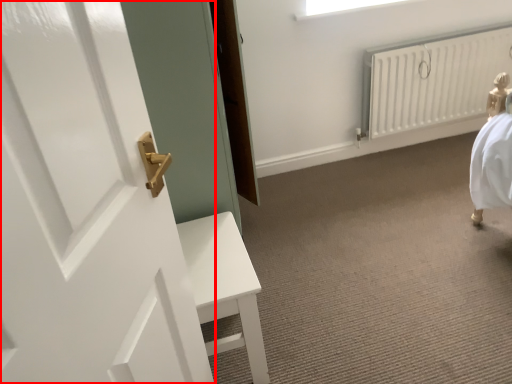
Question: From the image's perspective, what is the correct spatial positioning of door (annotated by the red box) in reference to radiator?

Choices:
 (A) below
 (B) above

Answer: (A)